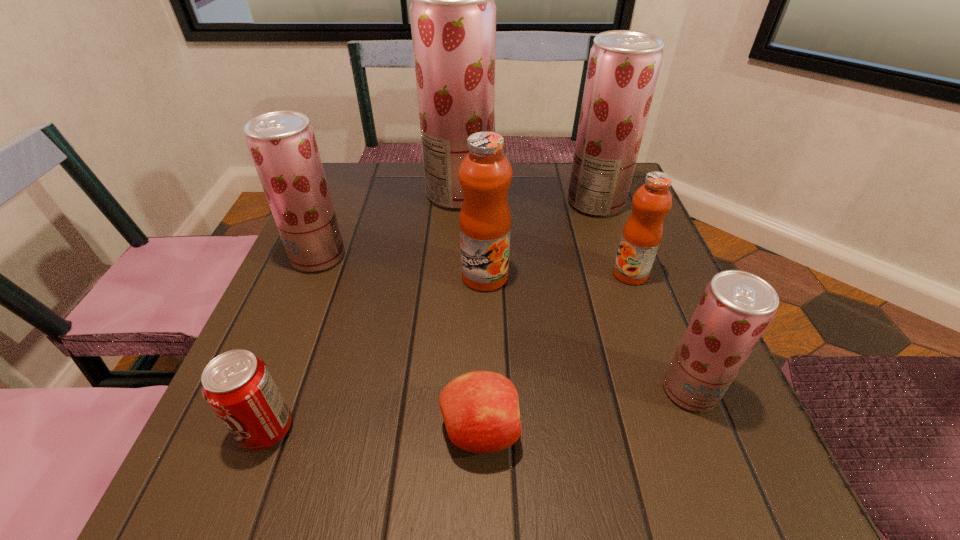
Where is `free point located on the back of the smallest strawberry fruit juice`? Image resolution: width=960 pixels, height=540 pixels. free point located on the back of the smallest strawberry fruit juice is located at coordinates (632, 244).

What are the coordinates of `vacant region located 0.140m on the right of the soda` in the screenshot? It's located at (387, 430).

The width and height of the screenshot is (960, 540). Identify the location of vacant space positioned 0.150m on the right of the red apple. (619, 431).

Locate an element on the screen. Image resolution: width=960 pixels, height=540 pixels. soda that is at the near edge is located at coordinates (238, 386).

Locate an element on the screen. The height and width of the screenshot is (540, 960). apple that is at the near edge is located at coordinates (480, 409).

Image resolution: width=960 pixels, height=540 pixels. In order to click on fruit juice positioned at the left edge in this screenshot , I will do (282, 144).

Image resolution: width=960 pixels, height=540 pixels. In order to click on soda at the left edge in this screenshot , I will do `click(238, 386)`.

Find the location of a particular element. This screenshot has width=960, height=540. object that is at the near left corner is located at coordinates (238, 386).

Where is `object at the far right corner`? The image size is (960, 540). object at the far right corner is located at coordinates (623, 68).

This screenshot has width=960, height=540. Identify the location of vacant space at the far edge of the desktop. (536, 168).